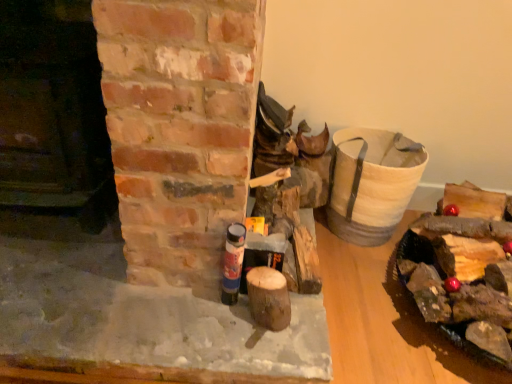
I want to click on vacant area that lies to the right of blue matte spray can at center, so click(286, 328).